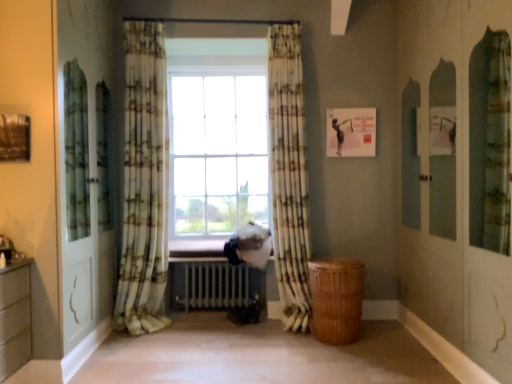
Question: Considering the relative positions of printed fabric curtain at center, which appears as the first curtain when viewed from the right, and printed fabric curtain at center, which appears as the 2th curtain when viewed from the right, in the image provided, is printed fabric curtain at center, which appears as the first curtain when viewed from the right, to the right of printed fabric curtain at center, which appears as the 2th curtain when viewed from the right, from the viewer's perspective?

Choices:
 (A) yes
 (B) no

Answer: (A)

Question: Does printed fabric curtain at center, which ranks as the 2th curtain in left-to-right order, have a greater width compared to printed fabric curtain at center, the 1th curtain when ordered from left to right?

Choices:
 (A) no
 (B) yes

Answer: (B)

Question: Would you say printed fabric curtain at center, which appears as the 2th curtain when viewed from the right, is part of printed fabric curtain at center, which ranks as the 2th curtain in left-to-right order,'s contents?

Choices:
 (A) yes
 (B) no

Answer: (B)

Question: Considering the relative sizes of printed fabric curtain at center, which appears as the first curtain when viewed from the right, and printed fabric curtain at center, the 1th curtain when ordered from left to right, in the image provided, is printed fabric curtain at center, which appears as the first curtain when viewed from the right, shorter than printed fabric curtain at center, the 1th curtain when ordered from left to right,?

Choices:
 (A) no
 (B) yes

Answer: (B)

Question: Considering the relative sizes of printed fabric curtain at center, which ranks as the 2th curtain in left-to-right order, and printed fabric curtain at center, the 1th curtain when ordered from left to right, in the image provided, is printed fabric curtain at center, which ranks as the 2th curtain in left-to-right order, bigger than printed fabric curtain at center, the 1th curtain when ordered from left to right,?

Choices:
 (A) yes
 (B) no

Answer: (B)

Question: Is printed fabric curtain at center, which ranks as the 2th curtain in left-to-right order, outside printed fabric curtain at center, the 1th curtain when ordered from left to right?

Choices:
 (A) yes
 (B) no

Answer: (A)

Question: Is printed fabric curtain at center, the 1th curtain when ordered from left to right, at the left side of printed fabric curtain at center, which ranks as the 2th curtain in left-to-right order?

Choices:
 (A) yes
 (B) no

Answer: (A)

Question: Is printed fabric curtain at center, which ranks as the 2th curtain in left-to-right order, a part of printed fabric curtain at center, which appears as the 2th curtain when viewed from the right?

Choices:
 (A) yes
 (B) no

Answer: (B)

Question: Would you consider printed fabric curtain at center, which appears as the 2th curtain when viewed from the right, to be distant from printed fabric curtain at center, which ranks as the 2th curtain in left-to-right order?

Choices:
 (A) no
 (B) yes

Answer: (B)

Question: From the image's perspective, is printed fabric curtain at center, which appears as the 2th curtain when viewed from the right, above printed fabric curtain at center, which ranks as the 2th curtain in left-to-right order?

Choices:
 (A) yes
 (B) no

Answer: (A)

Question: Is printed fabric curtain at center, which ranks as the 2th curtain in left-to-right order, at the back of printed fabric curtain at center, which appears as the 2th curtain when viewed from the right?

Choices:
 (A) yes
 (B) no

Answer: (B)

Question: From the image's perspective, is printed fabric curtain at center, which appears as the 2th curtain when viewed from the right, below printed fabric curtain at center, which appears as the first curtain when viewed from the right?

Choices:
 (A) yes
 (B) no

Answer: (B)

Question: Can you confirm if printed fabric curtain at center, the 1th curtain when ordered from left to right, is thinner than white metallic radiator at center?

Choices:
 (A) yes
 (B) no

Answer: (A)